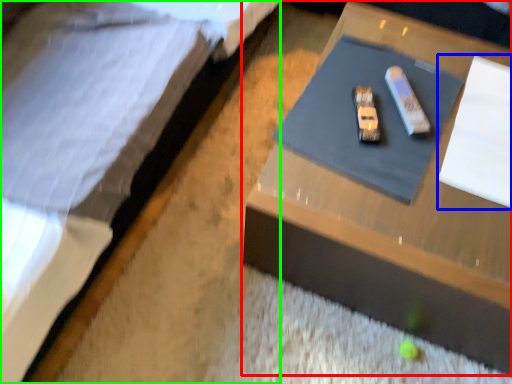
Question: Based on their relative distances, which object is nearer to table (highlighted by a red box)? Choose from notepad (highlighted by a blue box) and bed (highlighted by a green box).

Choices:
 (A) notepad
 (B) bed

Answer: (A)